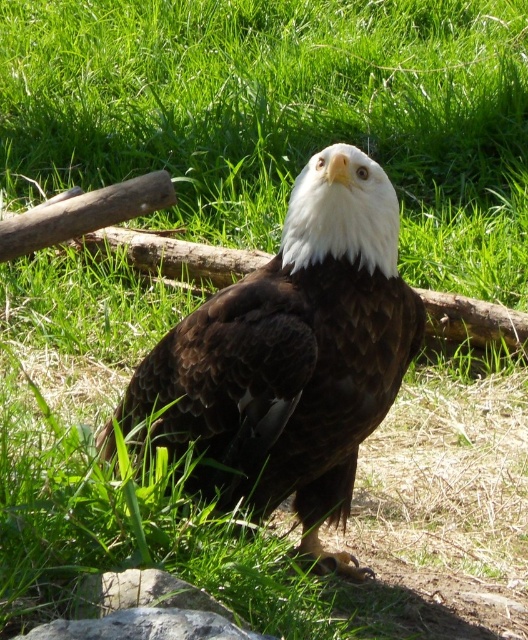
You are a photographer trying to capture the brown feathered eagle at center in the center of your photo. According to the image, is the eagle already positioned at the exact center of the frame?

The 2D location of brown feathered eagle at center is at point (294, 356), which is very close to the exact center of the frame but not precisely at the center coordinates of (264, 320). Therefore, the eagle is slightly off center.